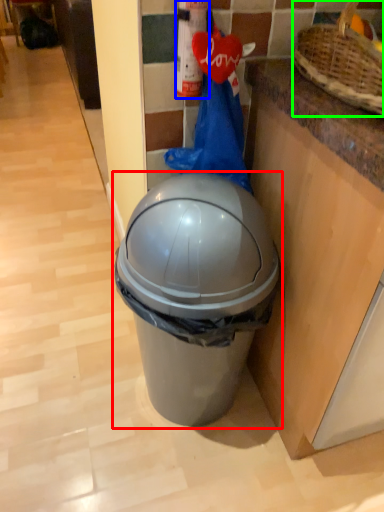
Question: Based on their relative distances, which object is nearer to waste container (highlighted by a red box)? Choose from extinguisher (highlighted by a blue box) and basket (highlighted by a green box).

Choices:
 (A) extinguisher
 (B) basket

Answer: (A)